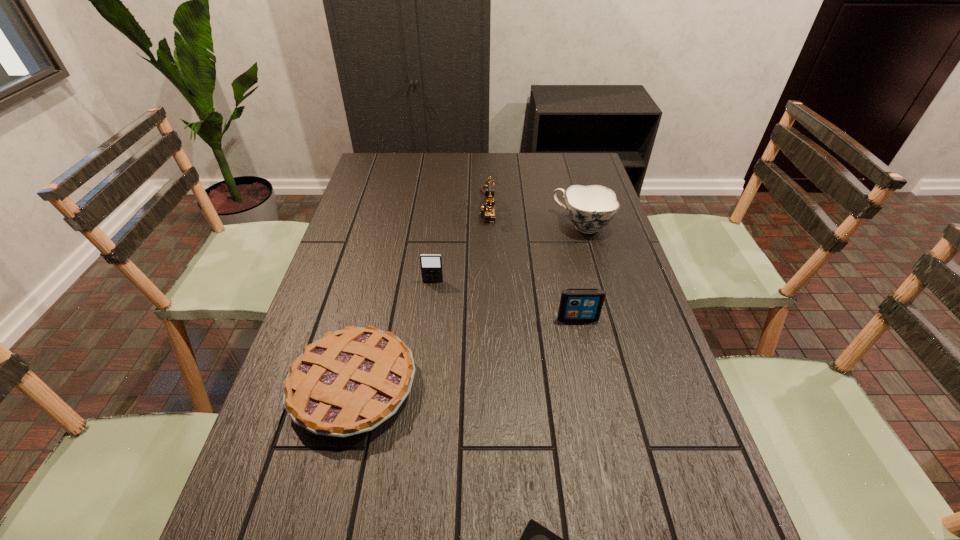
The height and width of the screenshot is (540, 960). Identify the location of telephone. (488, 207).

The height and width of the screenshot is (540, 960). I want to click on chinaware, so click(590, 208).

The image size is (960, 540). I want to click on the rightmost iPod, so click(576, 304).

Identify the location of the fourth farthest object. The height and width of the screenshot is (540, 960). (576, 304).

Where is `the leftmost iPod`? the leftmost iPod is located at coordinates (431, 264).

Identify the location of the farthest iPod. Image resolution: width=960 pixels, height=540 pixels. (431, 264).

The width and height of the screenshot is (960, 540). Identify the location of the fifth farthest object. click(x=350, y=381).

You are a GUI agent. You are given a task and a screenshot of the screen. Output one action in this format:
    pyautogui.click(x=<x>, y=<y>)
    Task: Click on the second shortest object
    
    Given the screenshot: What is the action you would take?
    pyautogui.click(x=350, y=381)

I want to click on vacant space located 0.290m on the front-facing side of the telephone, so click(397, 206).

You are a GUI agent. You are given a task and a screenshot of the screen. Output one action in this format:
    pyautogui.click(x=<x>, y=<y>)
    Task: Click on the vacant space situated 0.360m on the front-facing side of the telephone
    The width and height of the screenshot is (960, 540).
    Given the screenshot: What is the action you would take?
    pyautogui.click(x=377, y=206)